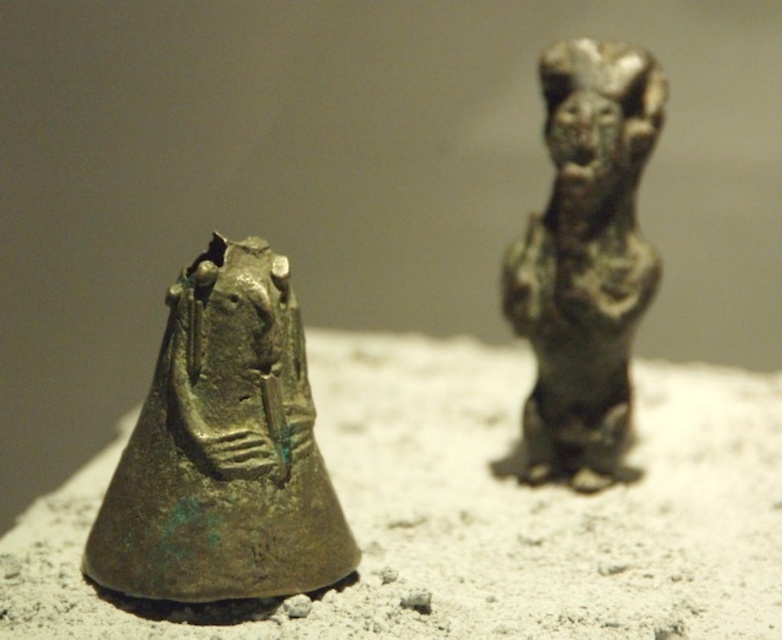
Question: Which point is farther from the camera taking this photo?

Choices:
 (A) (115, 545)
 (B) (598, 282)

Answer: (B)

Question: From the image, what is the correct spatial relationship of green patina bronze statue at left in relation to bronze figurine at right?

Choices:
 (A) below
 (B) above

Answer: (A)

Question: Is green patina bronze statue at left below bronze figurine at right?

Choices:
 (A) yes
 (B) no

Answer: (A)

Question: Can you confirm if green patina bronze statue at left is positioned below bronze figurine at right?

Choices:
 (A) no
 (B) yes

Answer: (B)

Question: Which object is farther from the camera taking this photo?

Choices:
 (A) bronze figurine at right
 (B) green patina bronze statue at left

Answer: (A)

Question: Among these points, which one is farthest from the camera?

Choices:
 (A) (216, 268)
 (B) (585, 289)

Answer: (B)